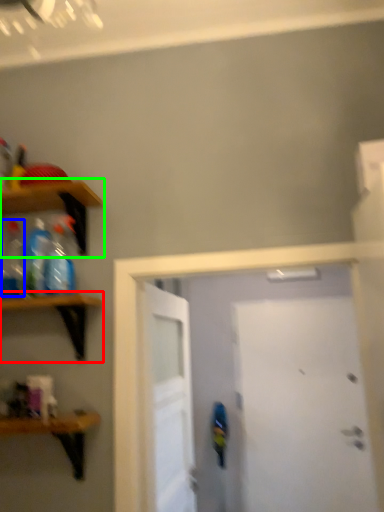
Question: Estimate the real-world distances between objects in this image. Which object is farther from shelf (highlighted by a red box), bottle (highlighted by a blue box) or shelf (highlighted by a green box)?

Choices:
 (A) bottle
 (B) shelf

Answer: (B)